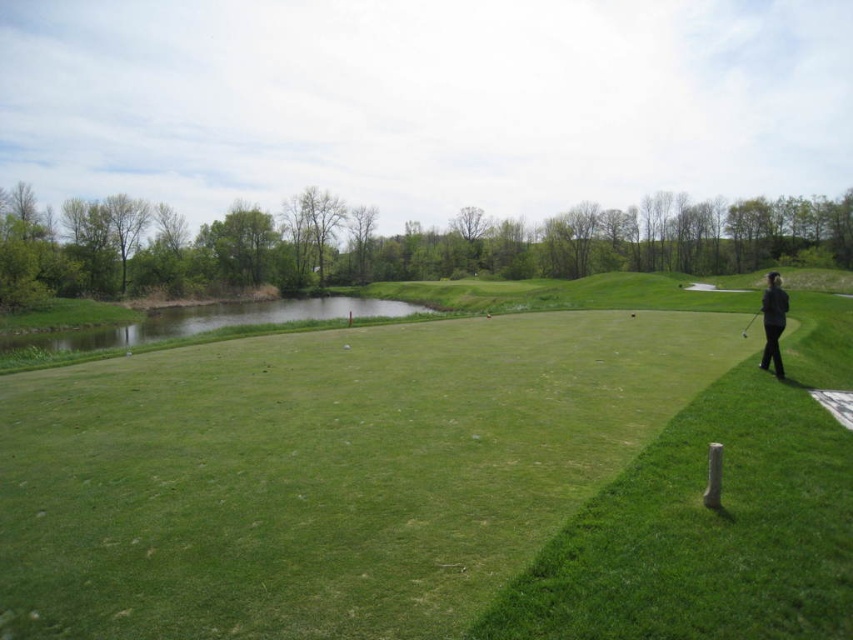
Is the position of green grassy pond at left more distant than that of metallic silver golf club at right?

No, it is in front of metallic silver golf club at right.

The image size is (853, 640). What are the coordinates of `green grassy pond at left` in the screenshot? It's located at (195, 324).

This screenshot has width=853, height=640. Find the location of `green grassy pond at left`. green grassy pond at left is located at coordinates (195, 324).

Is green grassy golf course at center further to camera compared to metallic silver golf club at right?

No, green grassy golf course at center is in front of metallic silver golf club at right.

Is green grassy golf course at center thinner than metallic silver golf club at right?

No.

At what (x,y) coordinates should I click in order to perform the action: click on green grassy golf course at center. Please return your answer as a coordinate pair (x, y). Looking at the image, I should click on (438, 481).

Is black fabric person at right to the right of metallic silver golf club at right from the viewer's perspective?

Yes, black fabric person at right is to the right of metallic silver golf club at right.

Who is more forward, (x=782, y=365) or (x=743, y=333)?

Point (x=782, y=365) is more forward.

Locate an element on the screen. The height and width of the screenshot is (640, 853). black fabric person at right is located at coordinates (773, 321).